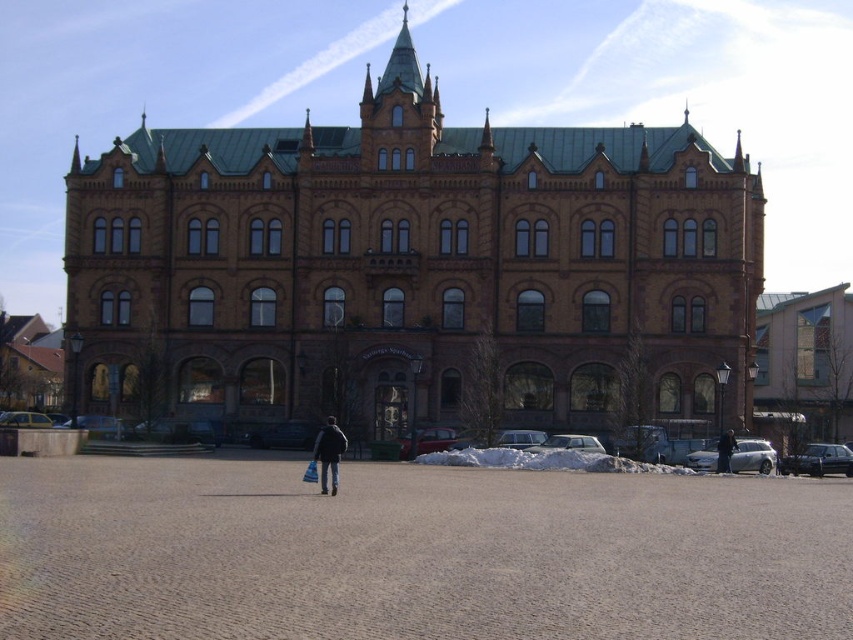
You are standing in front of the building and looking at two points marked on the structure. Which point, point (318, 480) or point (729, 445), is closer to you?

Point (318, 480) is closer to the viewer than point (729, 445).

You are a tailor measuring fabrics and garments in a room. You have a dark blue fabric at center and a black leather jacket at center. Which one is wider?

The dark blue fabric at center is wider than the black leather jacket at center according to the description provided.